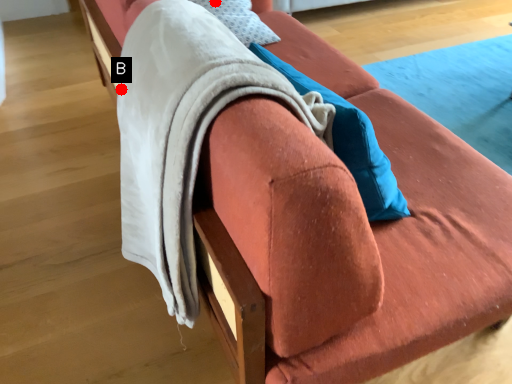
Question: Two points are circled on the image, labeled by A and B beside each circle. Which point is farther from the camera taking this photo?

Choices:
 (A) A is further
 (B) B is further

Answer: (A)